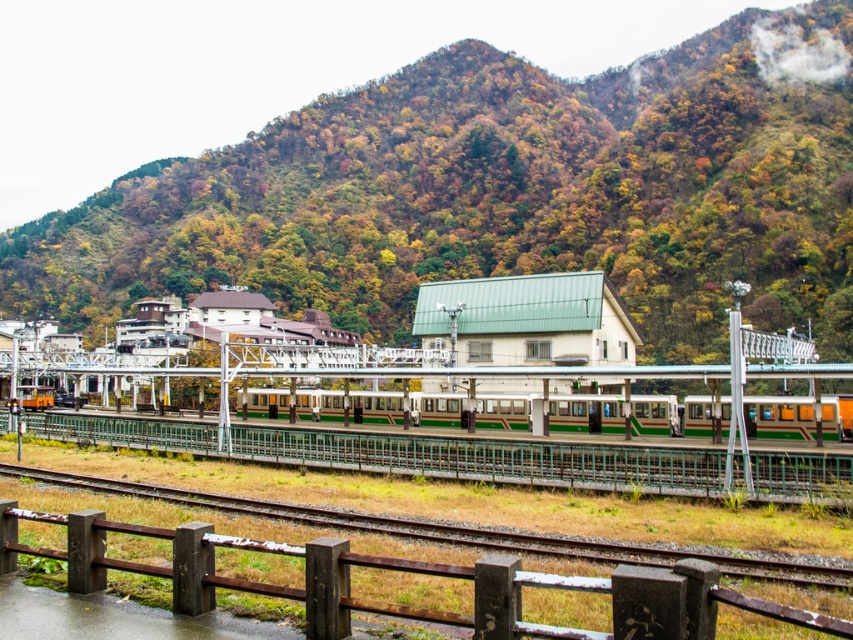
Question: Does green leafy hillside at upper center appear under green metallic train at center?

Choices:
 (A) no
 (B) yes

Answer: (A)

Question: Among these points, which one is farthest from the camera?

Choices:
 (A) (13, 400)
 (B) (838, 419)
 (C) (480, 625)
 (D) (80, 221)

Answer: (D)

Question: Based on their relative distances, which object is farther from the brown wooden fence at lower center?

Choices:
 (A) green leafy hillside at upper center
 (B) green metal fence at lower center
 (C) green matte train at center

Answer: (A)

Question: Considering the relative positions of green leafy hillside at upper center and green metallic train at center in the image provided, where is green leafy hillside at upper center located with respect to green metallic train at center?

Choices:
 (A) above
 (B) below

Answer: (A)

Question: Does green leafy hillside at upper center appear on the left side of brown wooden fence at lower center?

Choices:
 (A) yes
 (B) no

Answer: (A)

Question: Which point is closer to the camera taking this photo?

Choices:
 (A) (676, 422)
 (B) (35, 392)
 (C) (100, 428)

Answer: (C)